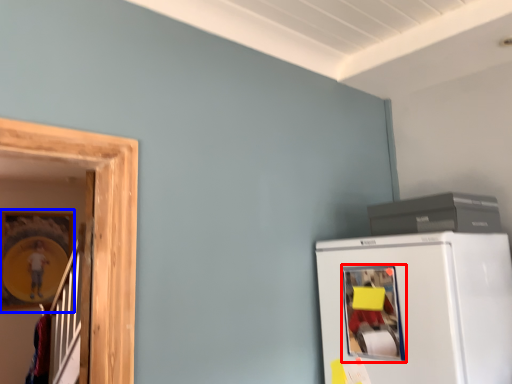
Question: Which point is closer to the camera, window (highlighted by a red box) or picture frame (highlighted by a blue box)?

Choices:
 (A) window
 (B) picture frame

Answer: (A)